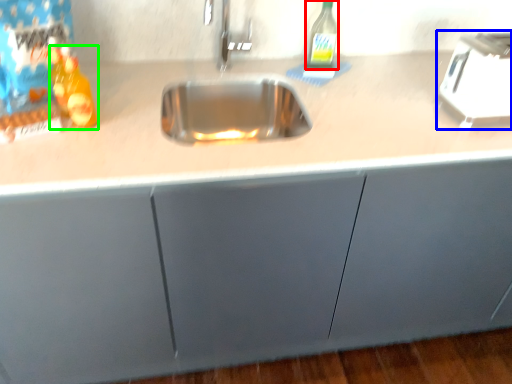
Question: Which object is positioned farthest from bottle (highlighted by a red box)? Select from appliance (highlighted by a blue box) and bottle (highlighted by a green box).

Choices:
 (A) appliance
 (B) bottle

Answer: (B)